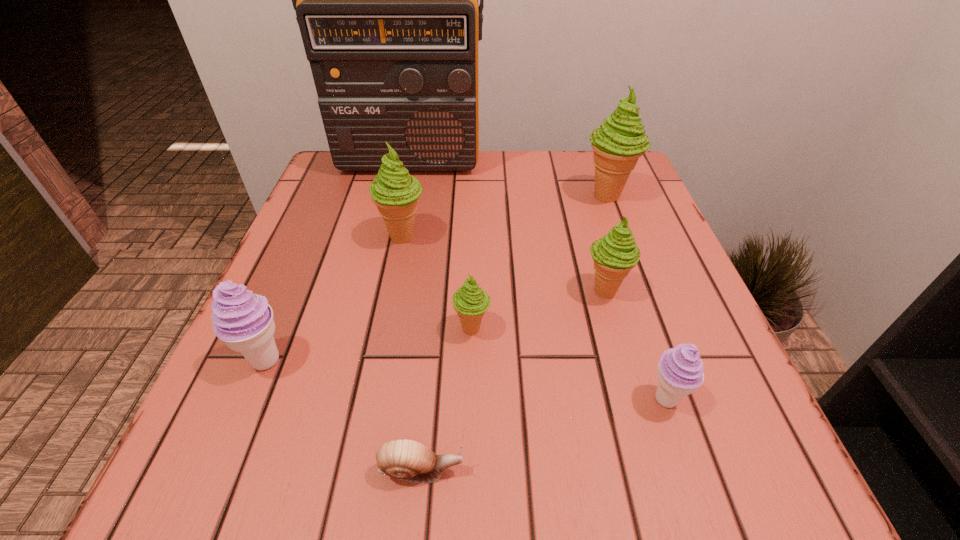
The height and width of the screenshot is (540, 960). I want to click on free space at the far edge, so click(x=479, y=192).

At what (x,y) coordinates should I click in order to perform the action: click on vacant space at the near edge of the desktop. Please return your answer as a coordinate pair (x, y). This screenshot has width=960, height=540. Looking at the image, I should click on (382, 444).

The image size is (960, 540). In order to click on vacant space at the left edge in this screenshot , I will do `click(324, 275)`.

The height and width of the screenshot is (540, 960). I want to click on vacant region at the near left corner of the desktop, so click(x=208, y=475).

The height and width of the screenshot is (540, 960). Identify the location of free space at the far right corner. (593, 151).

Locate an element on the screen. The image size is (960, 540). vacant space in between the third farthest green icecream and the nearest green icecream is located at coordinates (539, 309).

Where is `vacant space that's between the smaller purple icecream and the second smallest green icecream`? vacant space that's between the smaller purple icecream and the second smallest green icecream is located at coordinates (636, 345).

In order to click on free space between the second farthest object and the tallest object in this screenshot , I will do `click(508, 179)`.

In order to click on free space between the shortest object and the fourth farthest object in this screenshot , I will do `click(513, 380)`.

Where is `empty space between the third green icecream from right to left and the radio receiver`? empty space between the third green icecream from right to left and the radio receiver is located at coordinates (440, 246).